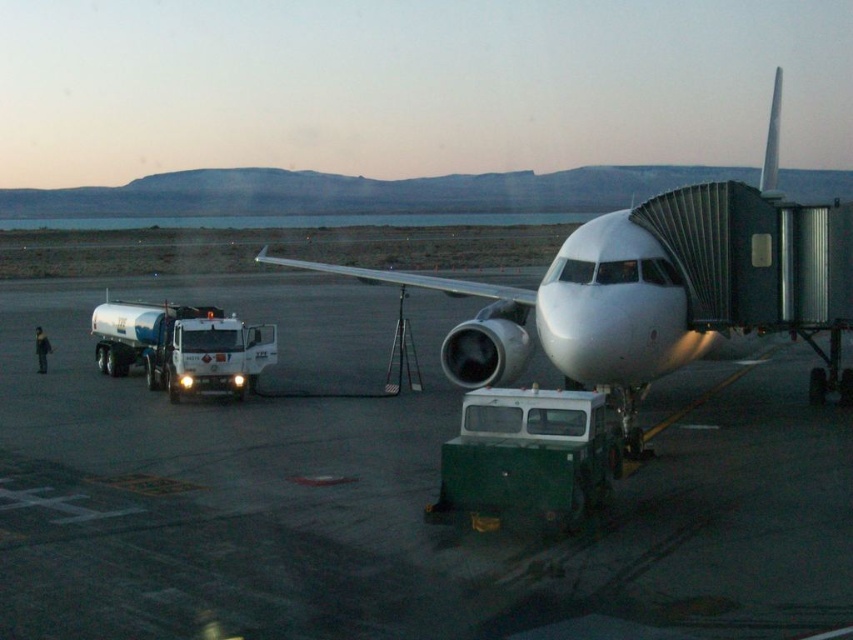
You are a ground crew member who needs to direct a delivery truck to the fuel truck. From the white glossy airplane at center, which direction should the delivery truck go to reach the white glossy fuel truck at left?

The white glossy fuel truck at left is to the left of the white glossy airplane at center, so the delivery truck should go left from the airplane to reach the fuel truck.

You are a maintenance worker needing to move from the green matte truck at lower center to the white glossy fuel truck at left. Given that your tool cart is 3 feet wide, will you be able to pass through the space between them without any obstruction?

The distance between the green matte truck at lower center and the white glossy fuel truck at left is 40.06 feet, which is more than sufficient for a 3 feet wide tool cart to pass through without any issues.

You are a pilot standing on the smooth asphalt tarmac at center and looking towards the white glossy airplane at center. Which object is taller from your perspective?

The white glossy airplane at center is taller than the smooth asphalt tarmac at center.